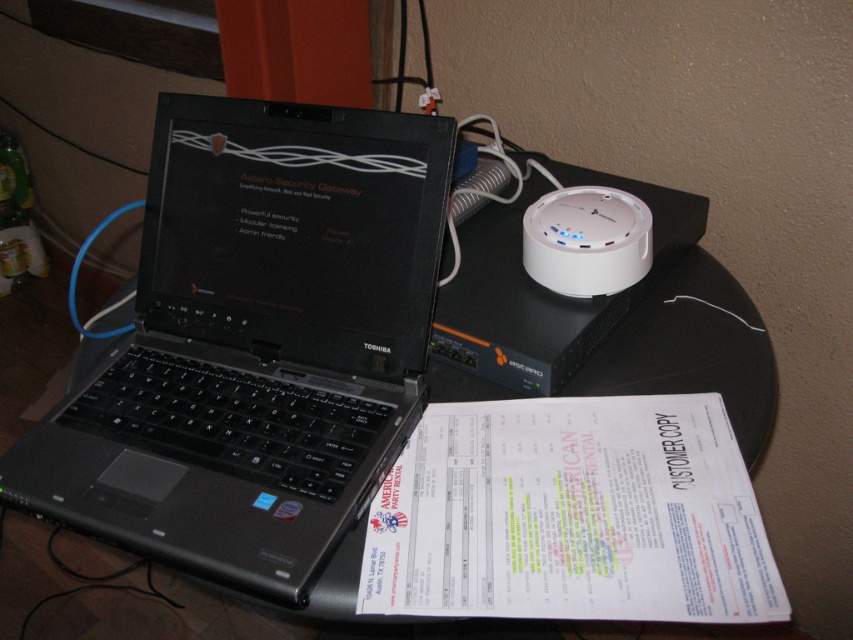
Question: Is black plastic laptop at center smaller than white plastic device at upper right?

Choices:
 (A) yes
 (B) no

Answer: (B)

Question: Which point is farther to the camera?

Choices:
 (A) white paper at lower center
 (B) black plastic laptop at center
 (C) white plastic device at upper right

Answer: (C)

Question: Among these objects, which one is farthest from the camera?

Choices:
 (A) white plastic device at upper right
 (B) white paper at lower center
 (C) black plastic laptop at center

Answer: (A)

Question: Considering the relative positions of white paper at lower center and white plastic device at upper right in the image provided, where is white paper at lower center located with respect to white plastic device at upper right?

Choices:
 (A) left
 (B) right

Answer: (A)

Question: Does black plastic laptop at center have a larger size compared to white plastic device at upper right?

Choices:
 (A) yes
 (B) no

Answer: (A)

Question: Which of the following is the farthest from the observer?

Choices:
 (A) black plastic laptop at center
 (B) white plastic device at upper right

Answer: (B)